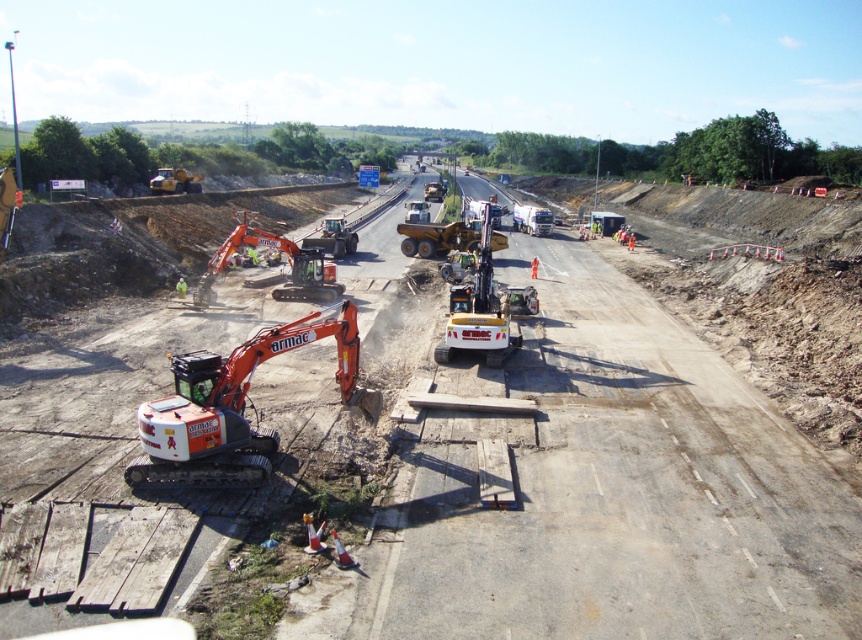
You are a delivery driver who needs to navigate through the construction site. You see a yellow metallic forklift at center and an orange rubber tracked excavator at left. Which vehicle can you pass through a narrow alley that is only 1.2 meters wide?

The yellow metallic forklift at center is thinner than the orange rubber tracked excavator at left, so the yellow metallic forklift at center can pass through the narrow alley that is only 1.2 meters wide.

You are a construction worker who needs to transport materials from the orange metallic excavator at lower left to the white plastic truck at center. Which vehicle should you load the materials onto first if you want to maximize efficiency?

The orange metallic excavator at lower left is smaller than the white plastic truck at center, so you should load the materials onto the white plastic truck at center first because it has a larger capacity and can carry more materials in one trip.

You are a construction worker needing to move materials from the forklift to the excavator. Can you walk directly between the yellow metallic forklift at center and the orange rubber tracked excavator at left without stepping over anything?

The yellow metallic forklift at center is in front of the orange rubber tracked excavator at left, so there is no space between them for you to walk directly. You would need to go around them.